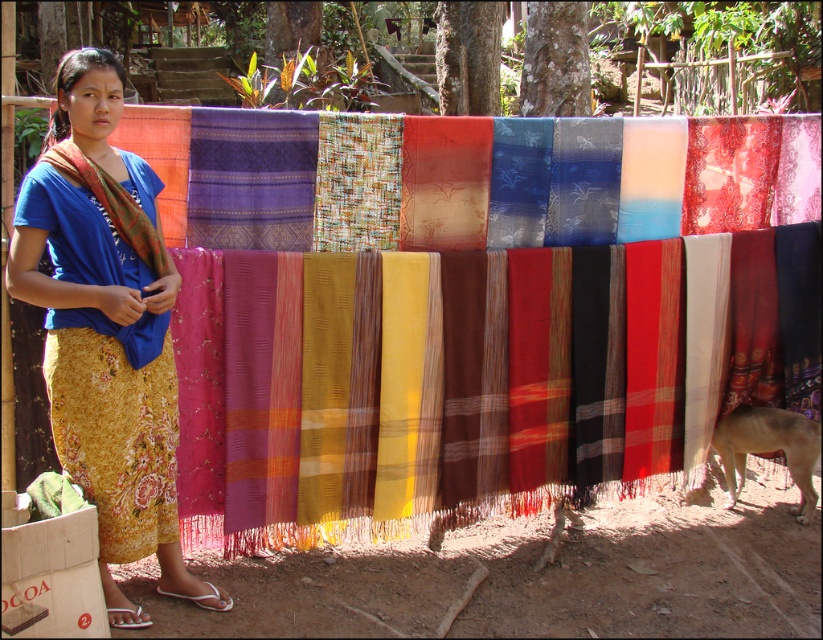
Is the position of matte blue shirt at center less distant than that of brown fur dog at lower right?

Yes, matte blue shirt at center is closer to the viewer.

Is matte blue shirt at center behind brown fur dog at lower right?

No, matte blue shirt at center is in front of brown fur dog at lower right.

Which is behind, point (110, 410) or point (737, 483)?

Positioned behind is point (737, 483).

Image resolution: width=823 pixels, height=640 pixels. I want to click on matte blue shirt at center, so click(105, 326).

Does point (59, 284) come in front of point (105, 196)?

Yes, it is in front of point (105, 196).

From the picture: Can you confirm if matte blue shirt at center is positioned to the left of matte orange shawl at left?

Correct, you'll find matte blue shirt at center to the left of matte orange shawl at left.

What do you see at coordinates (105, 326) in the screenshot? This screenshot has height=640, width=823. I see `matte blue shirt at center` at bounding box center [105, 326].

Locate an element on the screen. Image resolution: width=823 pixels, height=640 pixels. matte blue shirt at center is located at coordinates (105, 326).

Between matte woven cloth at center and brown fur dog at lower right, which one has more height?

With more height is matte woven cloth at center.

From the picture: Is matte woven cloth at center wider than brown fur dog at lower right?

Correct, the width of matte woven cloth at center exceeds that of brown fur dog at lower right.

Is point (189, 141) more distant than point (808, 449)?

That is False.

This screenshot has height=640, width=823. What are the coordinates of `matte woven cloth at center` in the screenshot? It's located at (477, 316).